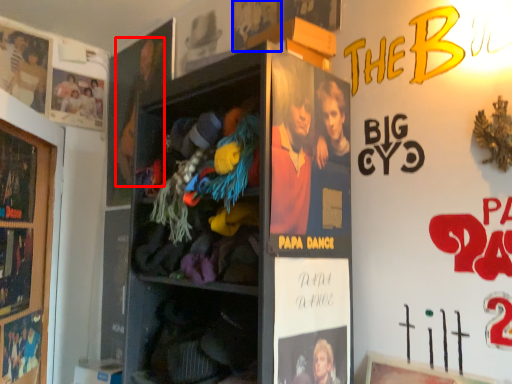
Question: Among these objects, which one is nearest to the camera, person (highlighted by a red box) or movie poster (highlighted by a blue box)?

Choices:
 (A) person
 (B) movie poster

Answer: (B)